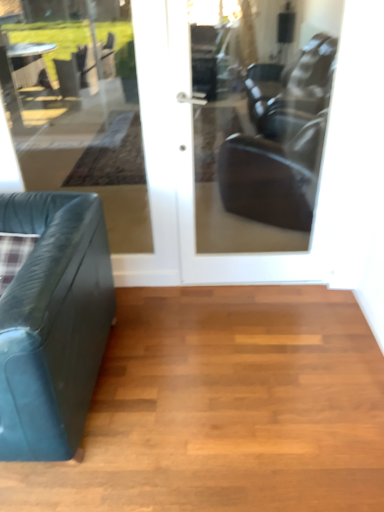
At what (x,y) coordinates should I click in order to perform the action: click on shiny brown hardwood floor at lower left. Please return your answer as a coordinate pair (x, y). Image resolution: width=384 pixels, height=512 pixels. Looking at the image, I should click on (225, 408).

The image size is (384, 512). I want to click on matte glass door at center, so click(x=249, y=191).

Identify the location of transparent glass door at center. This screenshot has width=384, height=512. (79, 111).

This screenshot has width=384, height=512. Identify the location of teal leather studio couch at left. (53, 323).

The height and width of the screenshot is (512, 384). What are the coordinates of `shiny brown hardwood floor at lower left` in the screenshot? It's located at (225, 408).

Does shiny brown hardwood floor at lower left touch transparent glass door at center?

No, shiny brown hardwood floor at lower left is not touching transparent glass door at center.

Is transparent glass door at center located within shiny brown hardwood floor at lower left?

No, shiny brown hardwood floor at lower left does not contain transparent glass door at center.

Could you tell me if shiny brown hardwood floor at lower left is turned towards transparent glass door at center?

No, shiny brown hardwood floor at lower left is not turned towards transparent glass door at center.

Is shiny brown hardwood floor at lower left in front of transparent glass door at center?

Yes, shiny brown hardwood floor at lower left is in front of transparent glass door at center.

Is transparent glass door at center wider than matte glass door at center?

No, transparent glass door at center is not wider than matte glass door at center.

Is transparent glass door at center with matte glass door at center?

No, transparent glass door at center is not in contact with matte glass door at center.

Is matte glass door at center at the back of transparent glass door at center?

That's not correct — transparent glass door at center is not looking away from matte glass door at center.

Measure the distance from transparent glass door at center to shiny brown hardwood floor at lower left.

transparent glass door at center and shiny brown hardwood floor at lower left are 5.10 meters apart.

Considering the sizes of objects transparent glass door at center and shiny brown hardwood floor at lower left in the image provided, who is thinner, transparent glass door at center or shiny brown hardwood floor at lower left?

Thinner between the two is transparent glass door at center.

Is transparent glass door at center positioned beyond the bounds of shiny brown hardwood floor at lower left?

Indeed, transparent glass door at center is completely outside shiny brown hardwood floor at lower left.

Considering the sizes of objects transparent glass door at center and shiny brown hardwood floor at lower left in the image provided, who is shorter, transparent glass door at center or shiny brown hardwood floor at lower left?

shiny brown hardwood floor at lower left is shorter.

Is matte glass door at center not near transparent glass door at center?

Yes, matte glass door at center is far from transparent glass door at center.

From the picture: Choose the correct answer: Is matte glass door at center inside transparent glass door at center or outside it?

matte glass door at center is not enclosed by transparent glass door at center.

Is matte glass door at center to the left or to the right of transparent glass door at center in the image?

From the image, it's evident that matte glass door at center is to the right of transparent glass door at center.

Considering the points (188, 38) and (132, 159), which point is behind, point (188, 38) or point (132, 159)?

The point (132, 159) is farther from the camera.

From the image's perspective, is matte glass door at center on shiny brown hardwood floor at lower left?

Yes, from the image's perspective, matte glass door at center is on top of shiny brown hardwood floor at lower left.

Which object is closer to the camera taking this photo, matte glass door at center or shiny brown hardwood floor at lower left?

shiny brown hardwood floor at lower left is more forward.

This screenshot has width=384, height=512. I want to click on door that is on the right side of shiny brown hardwood floor at lower left, so click(x=249, y=191).

Does point (267, 38) come farther from viewer compared to point (189, 464)?

Yes, it is behind point (189, 464).

Would you say teal leather studio couch at left is a long distance from shiny brown hardwood floor at lower left?

teal leather studio couch at left is near shiny brown hardwood floor at lower left, not far away.

Is teal leather studio couch at left bigger or smaller than shiny brown hardwood floor at lower left?

Considering their sizes, teal leather studio couch at left takes up more space than shiny brown hardwood floor at lower left.

Considering the relative positions of teal leather studio couch at left and shiny brown hardwood floor at lower left in the image provided, is teal leather studio couch at left to the left of shiny brown hardwood floor at lower left from the viewer's perspective?

Yes.

Does teal leather studio couch at left have a greater height compared to shiny brown hardwood floor at lower left?

Yes.

Based on the photo, is teal leather studio couch at left oriented towards transparent glass door at center?

No, teal leather studio couch at left does not turn towards transparent glass door at center.

Who is more distant, teal leather studio couch at left or transparent glass door at center?

Positioned behind is transparent glass door at center.

Is teal leather studio couch at left outside of transparent glass door at center?

Yes, teal leather studio couch at left is located beyond the bounds of transparent glass door at center.

Find the location of `hardwood below the transparent glass door at center (from the image's perspective)`. hardwood below the transparent glass door at center (from the image's perspective) is located at coordinates (225, 408).

You are a GUI agent. You are given a task and a screenshot of the screen. Output one action in this format:
    pyautogui.click(x=<x>, y=<y>)
    Task: Click on the door below the transparent glass door at center (from a real-world perspective)
    The image size is (384, 512).
    Given the screenshot: What is the action you would take?
    pyautogui.click(x=249, y=191)

Looking at the image, which one is located closer to transparent glass door at center, teal leather studio couch at left or matte glass door at center?

Based on the image, matte glass door at center appears to be nearer to transparent glass door at center.

When comparing their distances from teal leather studio couch at left, does matte glass door at center or transparent glass door at center seem closer?

Based on the image, matte glass door at center appears to be nearer to teal leather studio couch at left.

From the image, which object appears to be nearer to matte glass door at center, teal leather studio couch at left or shiny brown hardwood floor at lower left?

shiny brown hardwood floor at lower left is closer to matte glass door at center.

Looking at the image, which one is located further to transparent glass door at center, teal leather studio couch at left or shiny brown hardwood floor at lower left?

Based on the image, shiny brown hardwood floor at lower left appears to be further to transparent glass door at center.

Considering their positions, is teal leather studio couch at left positioned closer to shiny brown hardwood floor at lower left than transparent glass door at center?

teal leather studio couch at left is positioned closer to the anchor shiny brown hardwood floor at lower left.

Considering their positions, is matte glass door at center positioned further to transparent glass door at center than shiny brown hardwood floor at lower left?

shiny brown hardwood floor at lower left lies further to transparent glass door at center than the other object.

Consider the image. Looking at the image, which one is located closer to teal leather studio couch at left, shiny brown hardwood floor at lower left or transparent glass door at center?

The object closer to teal leather studio couch at left is shiny brown hardwood floor at lower left.

Looking at the image, which one is located closer to transparent glass door at center, shiny brown hardwood floor at lower left or matte glass door at center?

The object closer to transparent glass door at center is matte glass door at center.

I want to click on window between teal leather studio couch at left and matte glass door at center, so click(x=79, y=111).

What are the coordinates of `hardwood situated between teal leather studio couch at left and matte glass door at center from left to right` in the screenshot? It's located at (225, 408).

Find the location of a particular element. This screenshot has width=384, height=512. studio couch between transparent glass door at center and shiny brown hardwood floor at lower left vertically is located at coordinates (53, 323).

The image size is (384, 512). In order to click on door that lies between transparent glass door at center and shiny brown hardwood floor at lower left from top to bottom in this screenshot , I will do coord(249,191).